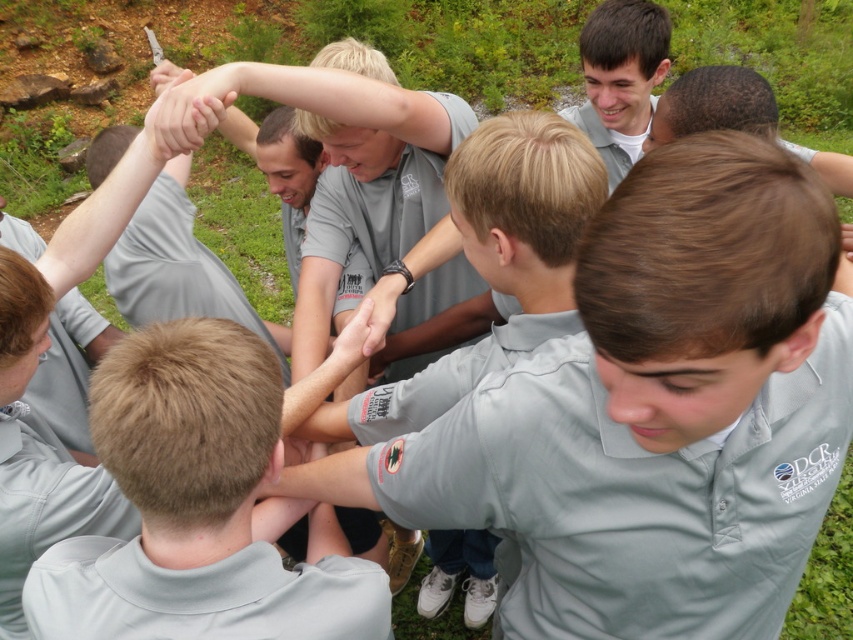
You are a photographer trying to capture the group in the center. Since the matte gray shirt at center and the matte gray hand at center are both in focus, which one will appear bigger in the photo?

The matte gray shirt at center will appear bigger in the photo because it is larger in size than the matte gray hand at center.

You are a photographer trying to capture the group in the center of the image. You notice the light brown hair at center and the matte gray hand at center. Which object should you focus on to ensure the other is in the background?

You should focus on the light brown hair at center because it is in front of the matte gray hand at center, so the matte gray hand at center will naturally be in the background.

You are a photographer standing in front of the group. You notice the matte gray shirt at center and the matte gray hand at center. Which object is closer to you?

The matte gray shirt at center is closer to the viewer than the matte gray hand at center.